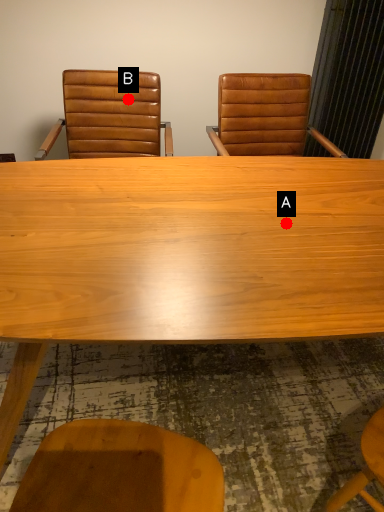
Question: Two points are circled on the image, labeled by A and B beside each circle. Which point is farther from the camera taking this photo?

Choices:
 (A) A is further
 (B) B is further

Answer: (B)